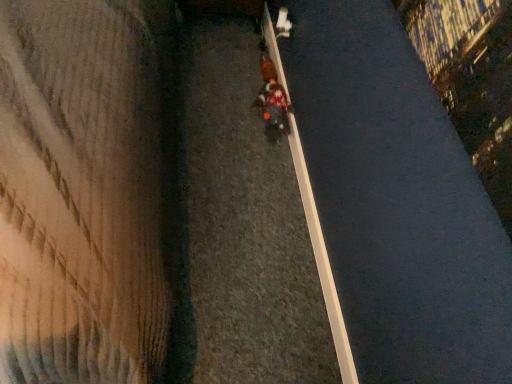
Question: From the image's perspective, is knitted sweater at center below white smooth curb at center?

Choices:
 (A) yes
 (B) no

Answer: (B)

Question: Can you confirm if knitted sweater at center is shorter than white smooth curb at center?

Choices:
 (A) no
 (B) yes

Answer: (A)

Question: Can you confirm if knitted sweater at center is smaller than white smooth curb at center?

Choices:
 (A) no
 (B) yes

Answer: (A)

Question: Can you confirm if knitted sweater at center is positioned to the right of white smooth curb at center?

Choices:
 (A) no
 (B) yes

Answer: (A)

Question: Does knitted sweater at center have a larger size compared to white smooth curb at center?

Choices:
 (A) no
 (B) yes

Answer: (B)

Question: From the image's perspective, is knitted sweater at center located above white smooth curb at center?

Choices:
 (A) no
 (B) yes

Answer: (B)

Question: Is white smooth curb at center surrounding knitted sweater at center?

Choices:
 (A) yes
 (B) no

Answer: (B)

Question: Considering the relative sizes of white smooth curb at center and knitted sweater at center in the image provided, is white smooth curb at center thinner than knitted sweater at center?

Choices:
 (A) no
 (B) yes

Answer: (B)

Question: Can you confirm if white smooth curb at center is wider than knitted sweater at center?

Choices:
 (A) no
 (B) yes

Answer: (A)

Question: Is white smooth curb at center outside knitted sweater at center?

Choices:
 (A) no
 (B) yes

Answer: (B)

Question: From a real-world perspective, is white smooth curb at center on top of knitted sweater at center?

Choices:
 (A) no
 (B) yes

Answer: (A)

Question: Is white smooth curb at center with knitted sweater at center?

Choices:
 (A) no
 (B) yes

Answer: (A)

Question: From the image's perspective, is white smooth curb at center below red fabric pedestrian at center?

Choices:
 (A) no
 (B) yes

Answer: (B)